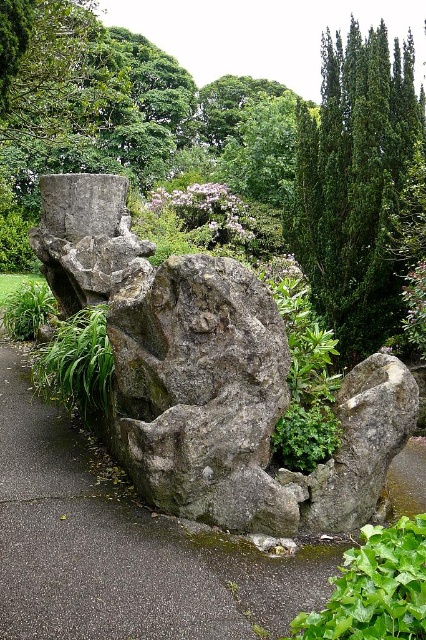
Between gray rough stone at center and green leafy bush at lower right, which one has more height?

Standing taller between the two is gray rough stone at center.

Which is behind, point (344, 396) or point (359, 637)?

Point (344, 396)

What do you see at coordinates (362, 445) in the screenshot? I see `gray rough stone at center` at bounding box center [362, 445].

Where is `gray rough stone at center`? Image resolution: width=426 pixels, height=640 pixels. gray rough stone at center is located at coordinates (362, 445).

Can you confirm if green textured tree at upper right is thinner than gray rough stone at center?

Yes, green textured tree at upper right is thinner than gray rough stone at center.

Is point (391, 307) behind point (327, 496)?

Yes, point (391, 307) is farther from viewer.

What do you see at coordinates (354, 184) in the screenshot? Image resolution: width=426 pixels, height=640 pixels. I see `green textured tree at upper right` at bounding box center [354, 184].

Image resolution: width=426 pixels, height=640 pixels. In order to click on green textured tree at upper right in this screenshot , I will do `click(354, 184)`.

Who is positioned more to the left, gray rough rock at center or gray rough stone at center?

gray rough rock at center is more to the left.

Between point (118, 262) and point (353, 412), which one is positioned behind?

Positioned behind is point (118, 262).

Which is behind, point (150, 428) or point (400, 422)?

The point (400, 422) is more distant.

Where is `gray rough rock at center`? This screenshot has width=426, height=640. gray rough rock at center is located at coordinates pyautogui.click(x=212, y=376).